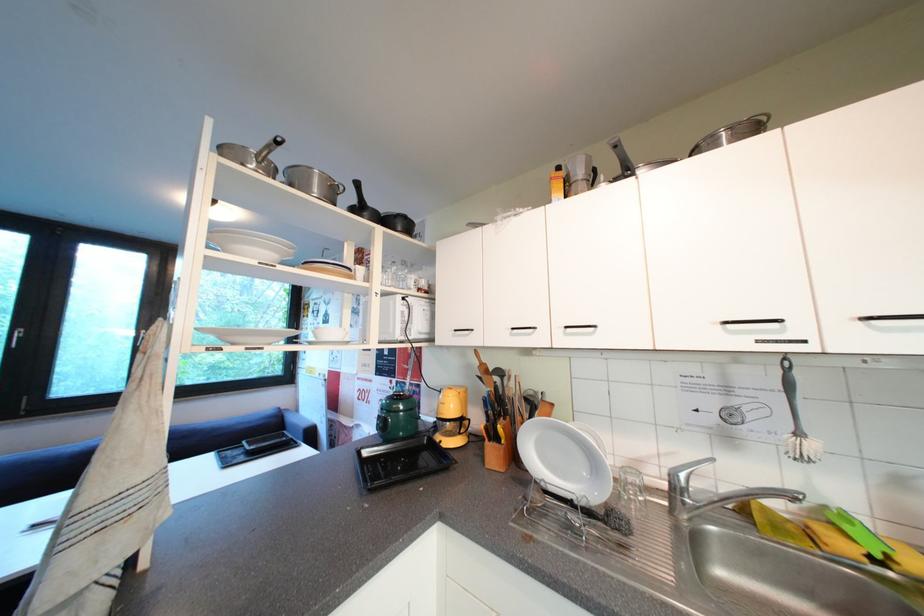
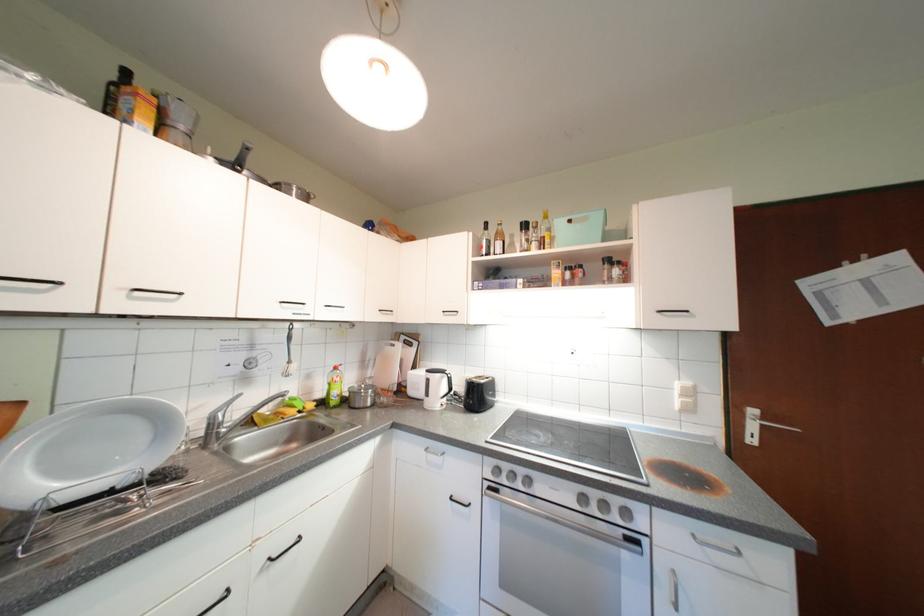
Where in the second image is the point corresponding to pixel 737 329 from the first image?

(292, 306)